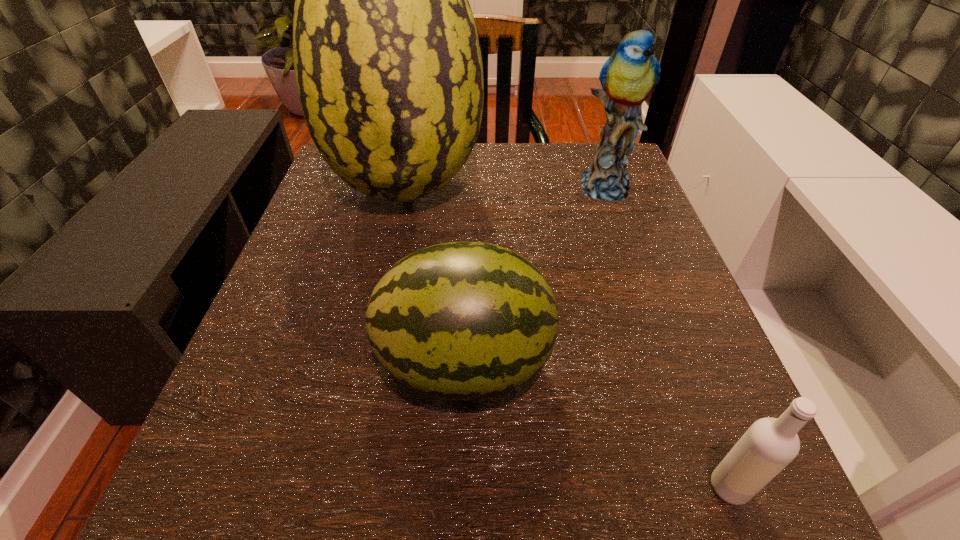
Select which object appears as the third closest to the parrot. Please provide its 2D coordinates. Your answer should be formatted as a tuple, i.e. [(x, y)], where the tuple contains the x and y coordinates of a point satisfying the conditions above.

[(770, 444)]

Where is `vacant space that satisfies the following two spatial constraints: 1. on the face of the parrot; 2. on the left side of the nearest object`? vacant space that satisfies the following two spatial constraints: 1. on the face of the parrot; 2. on the left side of the nearest object is located at coordinates (712, 487).

Where is `free space that satisfies the following two spatial constraints: 1. on the face of the second tallest object; 2. on the left side of the vodka`? free space that satisfies the following two spatial constraints: 1. on the face of the second tallest object; 2. on the left side of the vodka is located at coordinates (712, 487).

At what (x,y) coordinates should I click in order to perform the action: click on vacant area in the image that satisfies the following two spatial constraints: 1. at the stem end of the vodka; 2. on the right side of the shorter watermelon. Please return your answer as a coordinate pair (x, y). Looking at the image, I should click on (461, 487).

Find the location of a particular element. free space that satisfies the following two spatial constraints: 1. on the face of the second tallest object; 2. on the left side of the nearest object is located at coordinates click(712, 487).

Where is `vacant area that satisfies the following two spatial constraints: 1. on the face of the parrot; 2. at the stem end of the nearer watermelon`? vacant area that satisfies the following two spatial constraints: 1. on the face of the parrot; 2. at the stem end of the nearer watermelon is located at coordinates (668, 363).